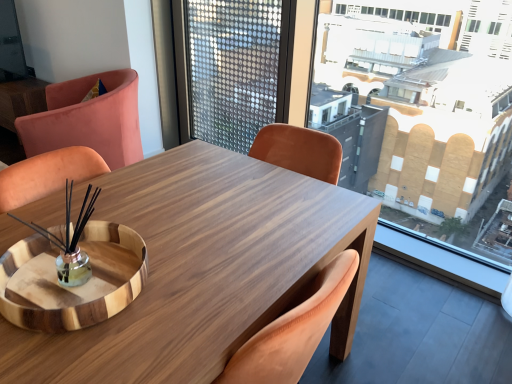
Image resolution: width=512 pixels, height=384 pixels. Find the location of `wooden tray at center`. wooden tray at center is located at coordinates (188, 260).

What do you see at coordinates (188, 260) in the screenshot? This screenshot has width=512, height=384. I see `wooden tray at center` at bounding box center [188, 260].

This screenshot has width=512, height=384. Find the location of `wooden tray at center`. wooden tray at center is located at coordinates (188, 260).